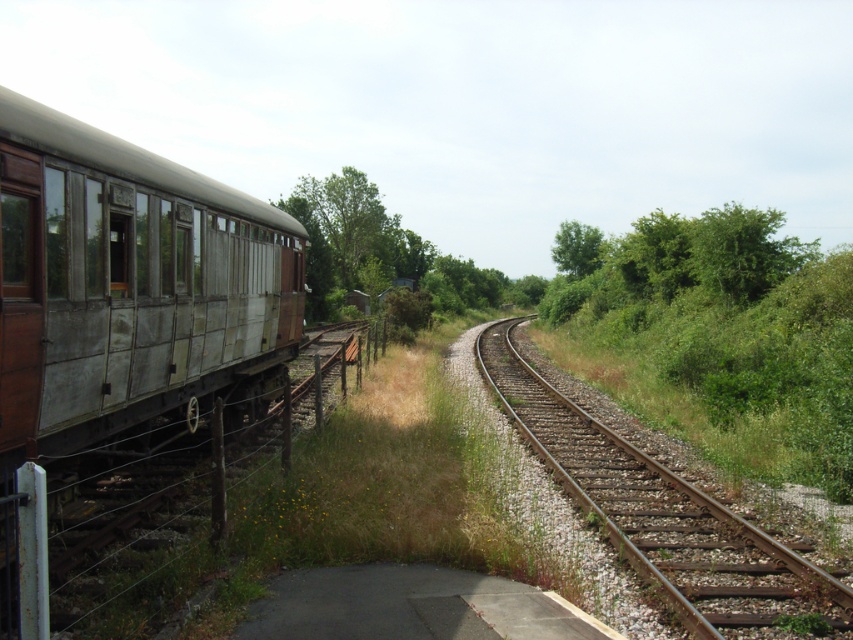
Question: Does rusty metal train car at left appear on the left side of green leafy tree at upper center?

Choices:
 (A) yes
 (B) no

Answer: (A)

Question: Is green leafy shrub at right below green leafy tree at upper center?

Choices:
 (A) no
 (B) yes

Answer: (B)

Question: Can you confirm if brown metal track at center is bigger than green leafy shrub at right?

Choices:
 (A) no
 (B) yes

Answer: (A)

Question: Which of these objects is positioned farthest from the rusty metal rail at left?

Choices:
 (A) green leafy tree at upper center
 (B) brown metal track at center

Answer: (A)

Question: Which point is closer to the camera taking this photo?

Choices:
 (A) (599, 260)
 (B) (643, 493)
 (C) (276, 358)

Answer: (B)

Question: Which of these objects is positioned farthest from the rusty metal rail at left?

Choices:
 (A) green leafy tree at upper center
 (B) brown metal track at center
 (C) rusty metal train car at left
 (D) green leafy shrub at right

Answer: (A)